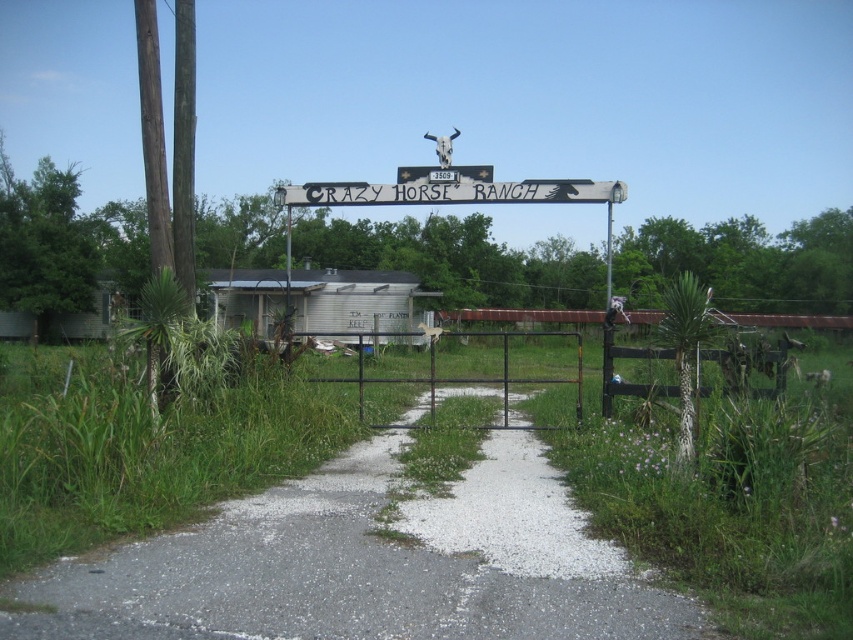
Question: Can you confirm if white painted wood sign at center is wider than wooden signpost at center?

Choices:
 (A) yes
 (B) no

Answer: (B)

Question: Does white painted wood sign at center have a lesser width compared to wooden signpost at center?

Choices:
 (A) no
 (B) yes

Answer: (B)

Question: Which object is positioned closest to the black metal gate at center?

Choices:
 (A) gravel path at center
 (B) brown wooden fence at right

Answer: (B)

Question: Among these points, which one is nearest to the camera?

Choices:
 (A) (610, 202)
 (B) (366, 193)
 (C) (616, 388)
 (D) (421, 401)

Answer: (C)

Question: Does black metal gate at center have a larger size compared to wooden signpost at center?

Choices:
 (A) no
 (B) yes

Answer: (A)

Question: Which object appears closest to the camera in this image?

Choices:
 (A) white painted wood sign at center
 (B) black metal gate at center
 (C) wooden signpost at center

Answer: (A)